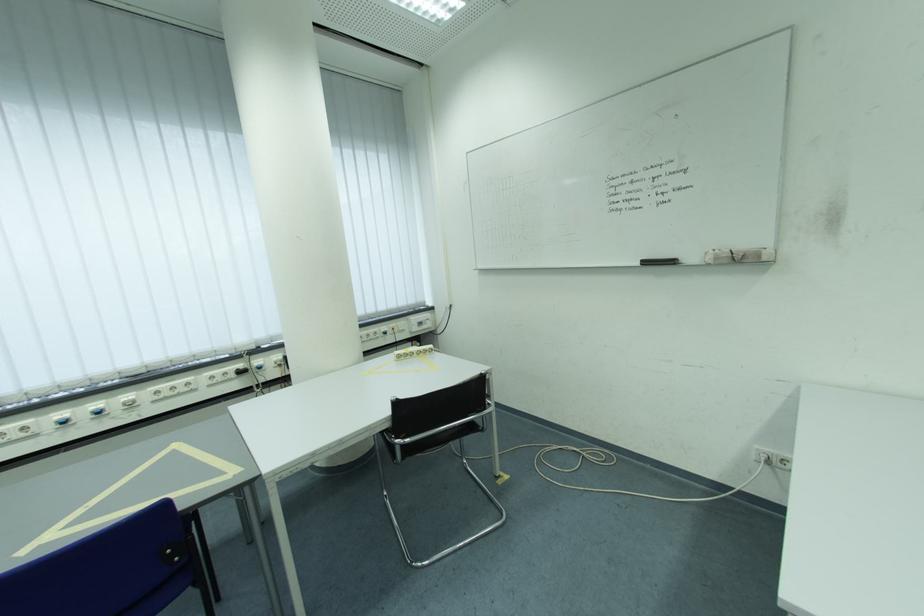
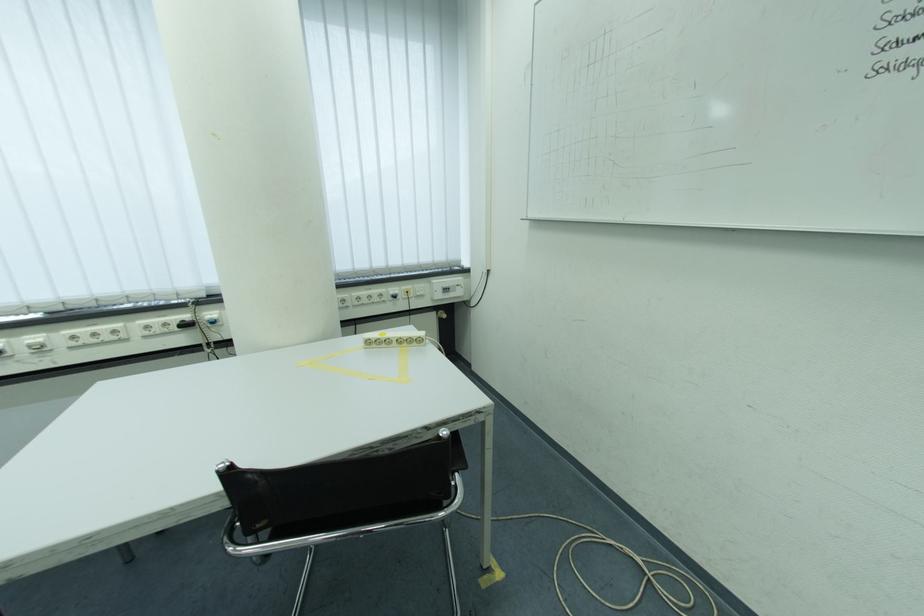
Where in the second image is the point corresponding to (234,376) from the first image?

(175, 326)